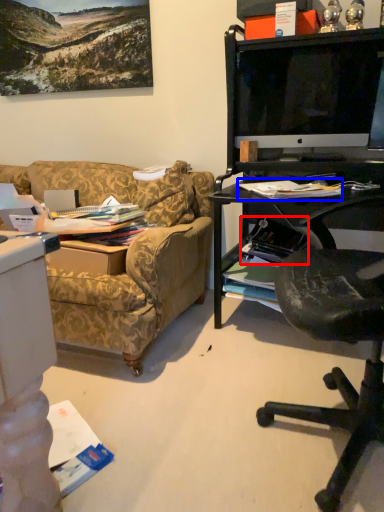
Question: Which object is closer to the camera taking this photo, magazine (highlighted by a red box) or magazine (highlighted by a blue box)?

Choices:
 (A) magazine
 (B) magazine

Answer: (B)